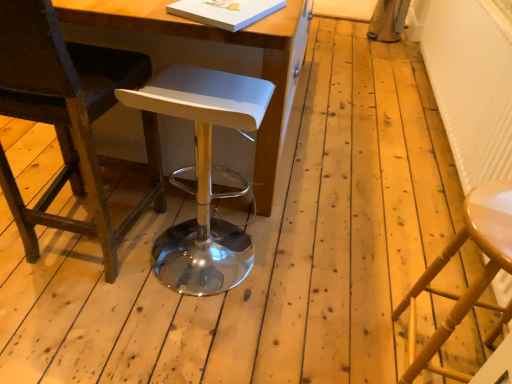
This screenshot has height=384, width=512. I want to click on vacant area that lies between wooden table at center and wooden chair at right, positioned as the second stool in left-to-right order, so click(x=329, y=214).